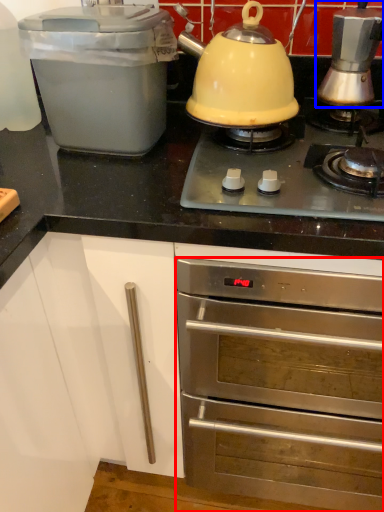
Question: Which of the following is the farthest to the observer, oven (highlighted by a red box) or kitchen appliance (highlighted by a blue box)?

Choices:
 (A) oven
 (B) kitchen appliance

Answer: (B)